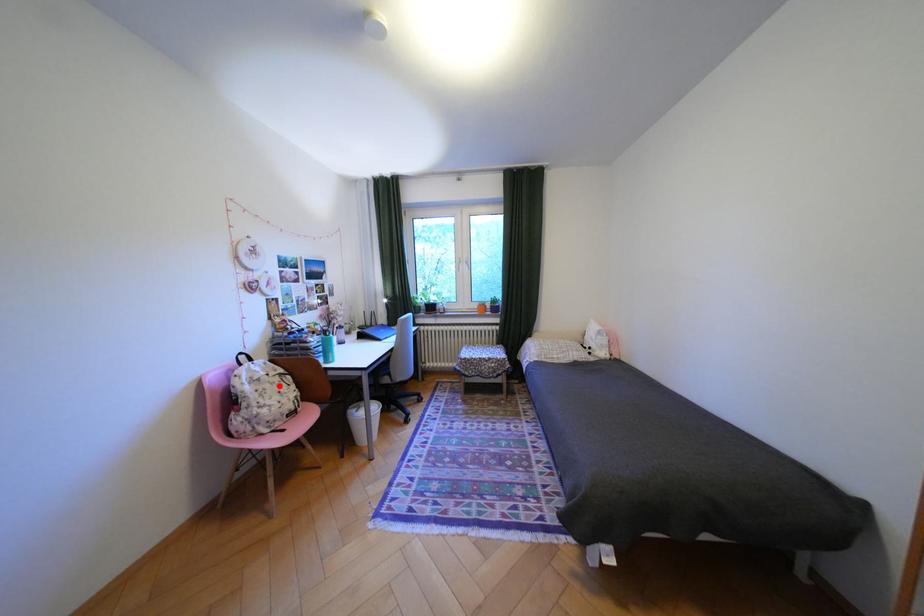
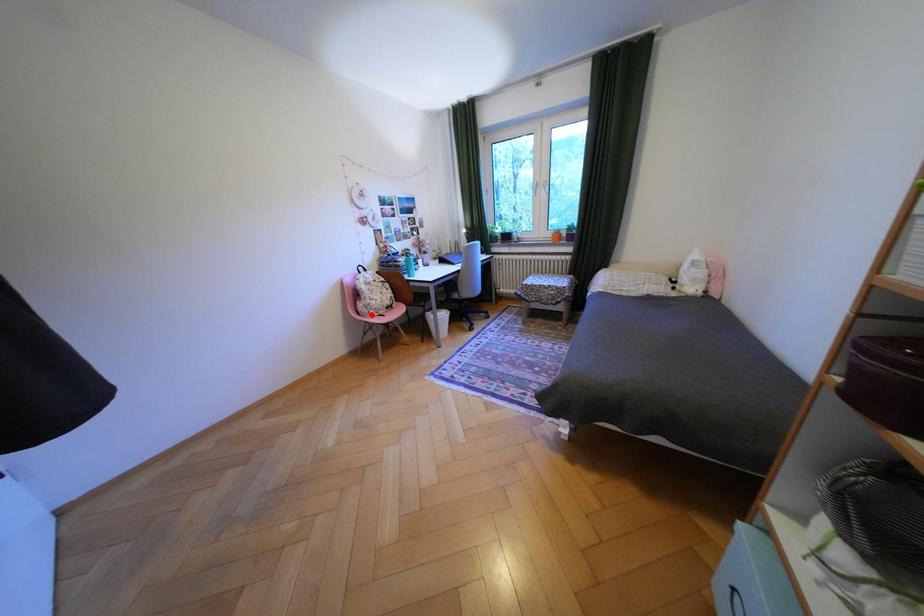
I am providing you with two images of the same scene from different viewpoints. A red point is marked on the first image and another point is marked on the second image. Does the point marked in image1 correspond to the same location as the one in image2?

No